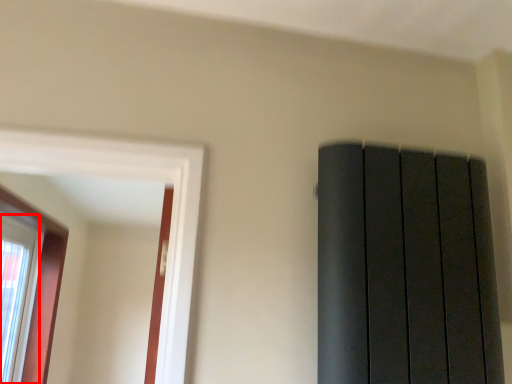
Question: Where is window (annotated by the red box) located in relation to window in the image?

Choices:
 (A) right
 (B) left

Answer: (B)